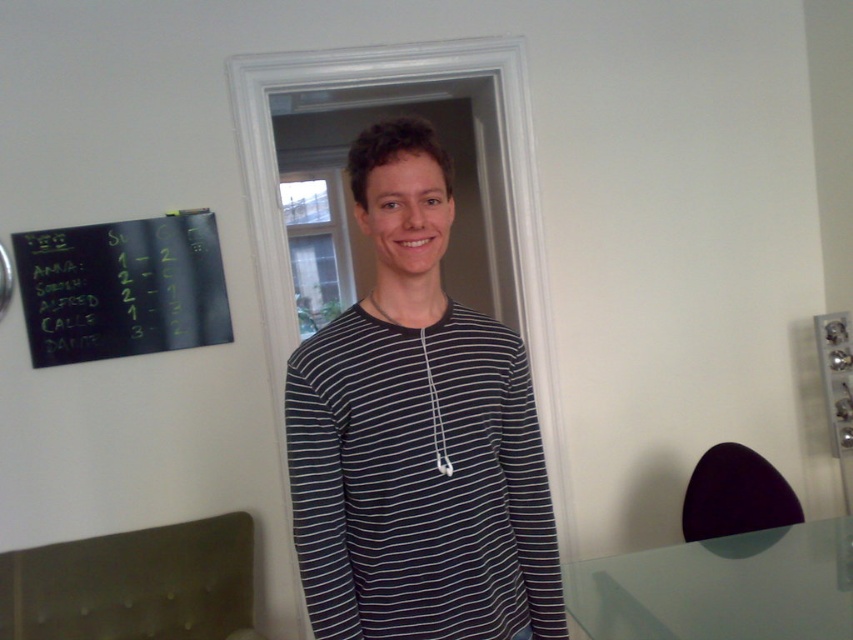
You are a photographer setting up for a portrait shoot. You need to ensure that the black striped shirt at center and the transparent glass table at lower right are both visible in the frame. Based on their sizes, which object should you focus on first to ensure proper framing?

The black striped shirt at center has a greater height compared to the transparent glass table at lower right, so you should focus on framing the black striped shirt at center first to accommodate its larger size in the composition.

You are trying to place a small plant on the transparent glass table at lower right. To ensure it doesn

The transparent glass table at lower right is located at coordinate point (721,588), so placing the plant there would be possible as long as the table has enough space.

You are planning to place a large plant on the transparent glass table at lower right. Considering the size of the black chalkboard at upper left, will the plant fit on the table?

The transparent glass table at lower right is bigger than the black chalkboard at upper left, so the plant should fit comfortably on the table since it is larger in size.